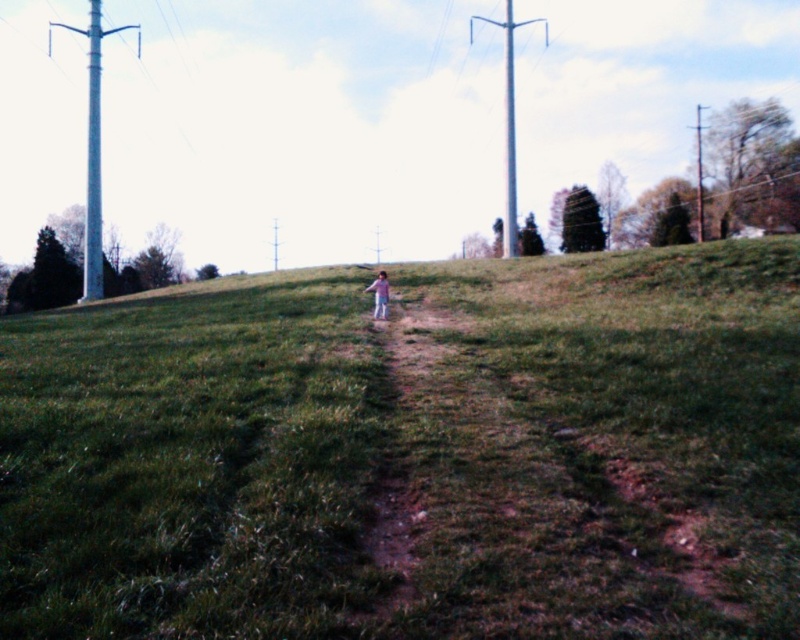
You are standing at the base of the hill and see the dirt path at center and the white metallic telegraph pole at left. Which object is nearer to you?

The dirt path at center is closer to the viewer than the white metallic telegraph pole at left, so the dirt path at center is nearer to you.